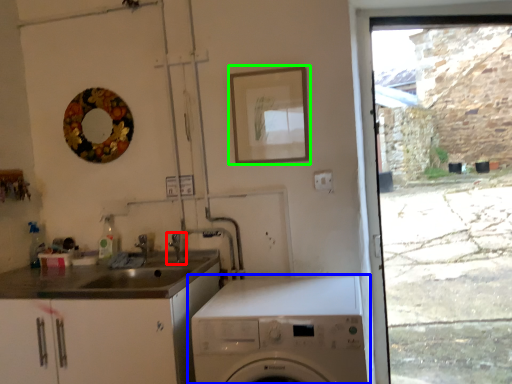
Question: Which object is positioned closest to tap (highlighted by a red box)? Select from washing machine (highlighted by a blue box) and picture frame (highlighted by a green box).

Choices:
 (A) washing machine
 (B) picture frame

Answer: (B)